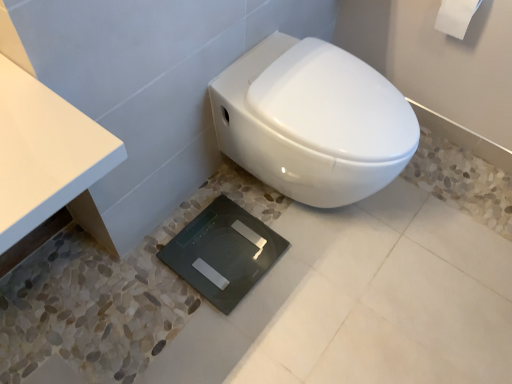
The width and height of the screenshot is (512, 384). Identify the location of empty space that is to the right of white glossy toilet at center. (444, 230).